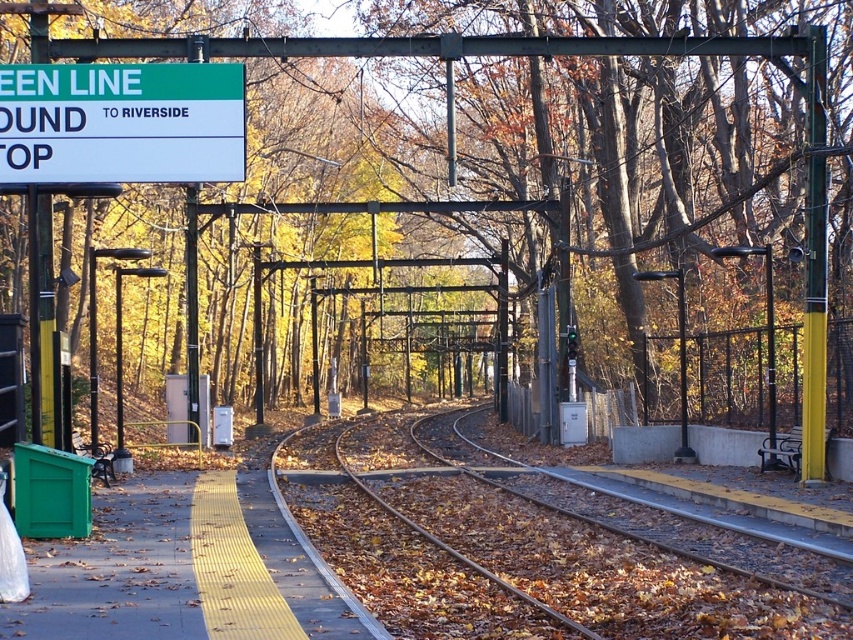
You are standing on the train station platform and want to reach the point marked at coordinates (334, 422). Given that the platform is 50 meters long, can you safely walk to that point without exceeding the platform length?

The point at (334, 422) is 51.89 meters away from the camera, which is slightly beyond the platform length of 50 meters. Therefore, you cannot safely walk to that point without exceeding the platform length.